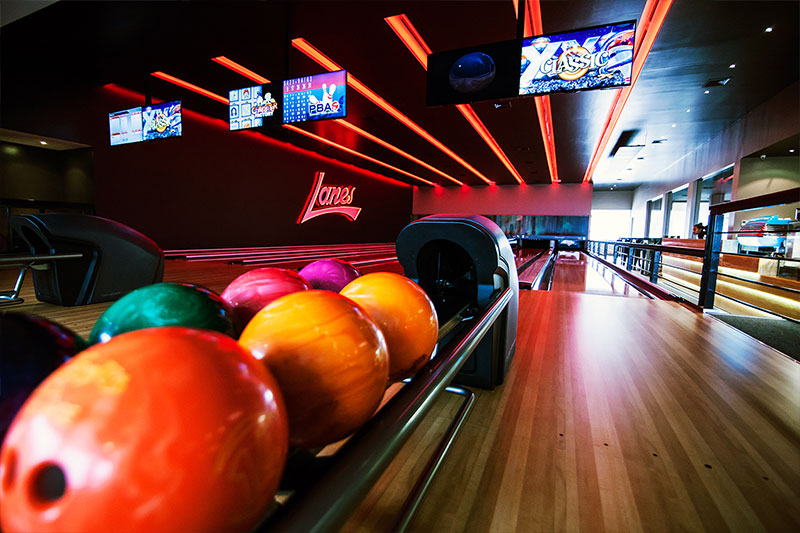
Where is `screen`? The height and width of the screenshot is (533, 800). screen is located at coordinates tap(590, 61), tap(469, 68), tap(313, 100), tap(262, 102), tap(169, 122), tap(128, 122).